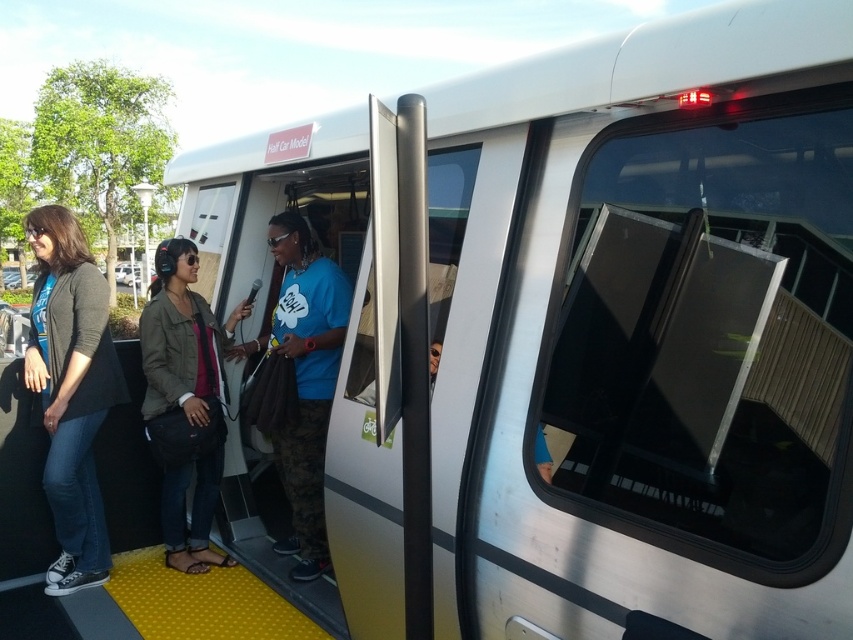
You are a photographer trying to capture a candid shot of both the matte black jacket at left and the denim jacket at center. Since you can only focus on one jacket at a time, which jacket should you aim your camera at first to ensure the other remains in the frame?

The matte black jacket at left is positioned on the left side of denim jacket at center. To keep both in frame, focus on the denim jacket at center first as it is centrally located, allowing the left jacket to stay within the shot.